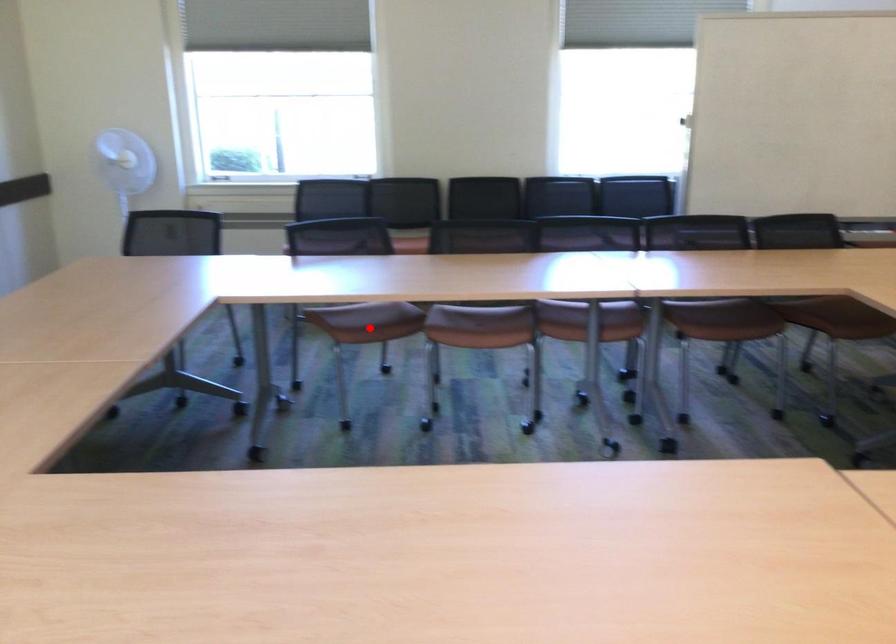
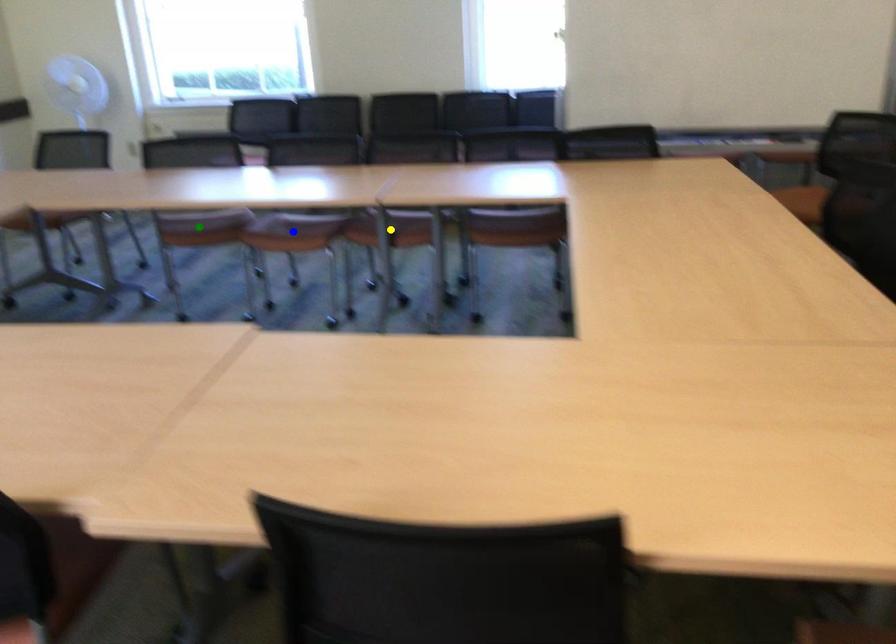
Question: I am providing you with two images of the same scene from different viewpoints. A red point is marked on the first image. You are given multiple points on the second image. Can you choose the point in image 2 that corresponds to the point in image 1?

Choices:
 (A) green point
 (B) blue point
 (C) yellow point

Answer: (A)